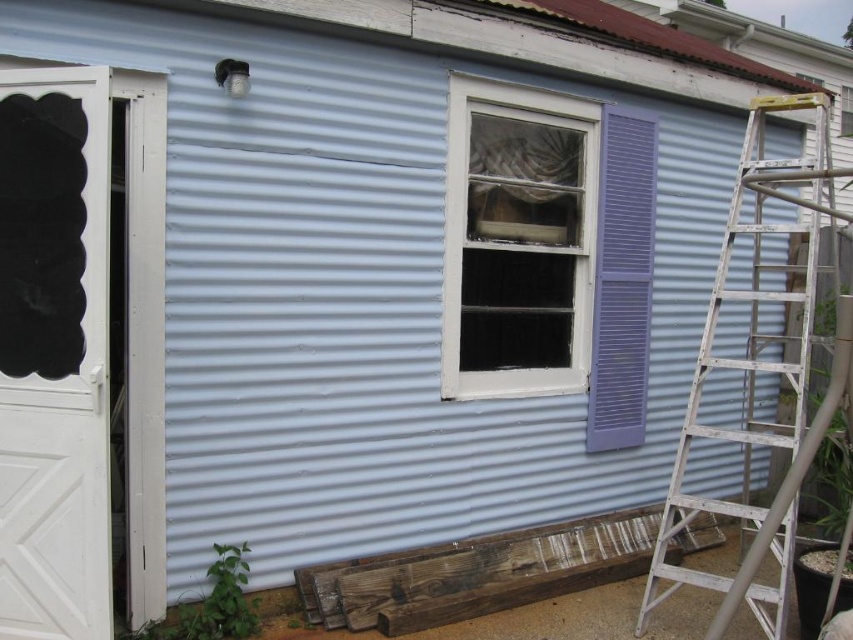
Does white matte door at left appear on the left side of white aluminum ladder at right?

Correct, you'll find white matte door at left to the left of white aluminum ladder at right.

Describe the element at coordinates (54, 353) in the screenshot. I see `white matte door at left` at that location.

Between point (107, 324) and point (740, 513), which one is positioned behind?

Point (740, 513)

In order to click on white matte door at left in this screenshot , I will do `click(54, 353)`.

The image size is (853, 640). What do you see at coordinates (517, 241) in the screenshot? I see `white wood window at center` at bounding box center [517, 241].

Locate an element on the screen. white wood window at center is located at coordinates (517, 241).

Is point (33, 209) more distant than point (485, 304)?

No, it is not.

Identify the location of white matte door at left. This screenshot has width=853, height=640. (54, 353).

Which is in front, point (20, 381) or point (508, 296)?

Positioned in front is point (20, 381).

Find the location of a particular element. The width and height of the screenshot is (853, 640). white matte door at left is located at coordinates (54, 353).